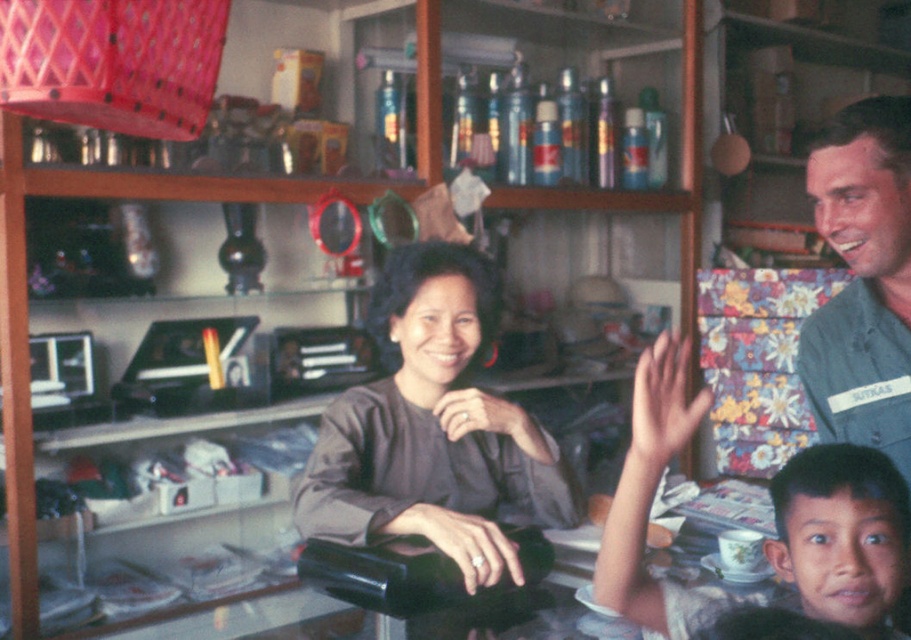
Question: Is gray fabric shirt at center smaller than denim shirt at upper right?

Choices:
 (A) yes
 (B) no

Answer: (B)

Question: Considering the real-world distances, which object is closest to the dark brown hair at lower right?

Choices:
 (A) smooth skin child at center
 (B) gray fabric shirt at center
 (C) denim shirt at upper right

Answer: (A)

Question: Is smooth skin child at center thinner than dark brown hair at lower right?

Choices:
 (A) no
 (B) yes

Answer: (A)

Question: Which of these objects is positioned closest to the gray fabric shirt at center?

Choices:
 (A) smooth skin child at center
 (B) denim shirt at upper right

Answer: (A)

Question: Which of the following is the closest to the observer?

Choices:
 (A) (840, 250)
 (B) (359, 392)

Answer: (A)

Question: Observing the image, what is the correct spatial positioning of smooth skin child at center in reference to denim shirt at upper right?

Choices:
 (A) right
 (B) left

Answer: (B)